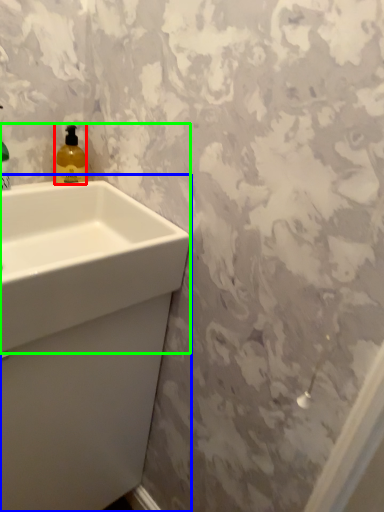
Question: Based on their relative distances, which object is farther from soap dispenser (highlighted by a red box)? Choose from sink (highlighted by a blue box) and sink (highlighted by a green box).

Choices:
 (A) sink
 (B) sink

Answer: (A)